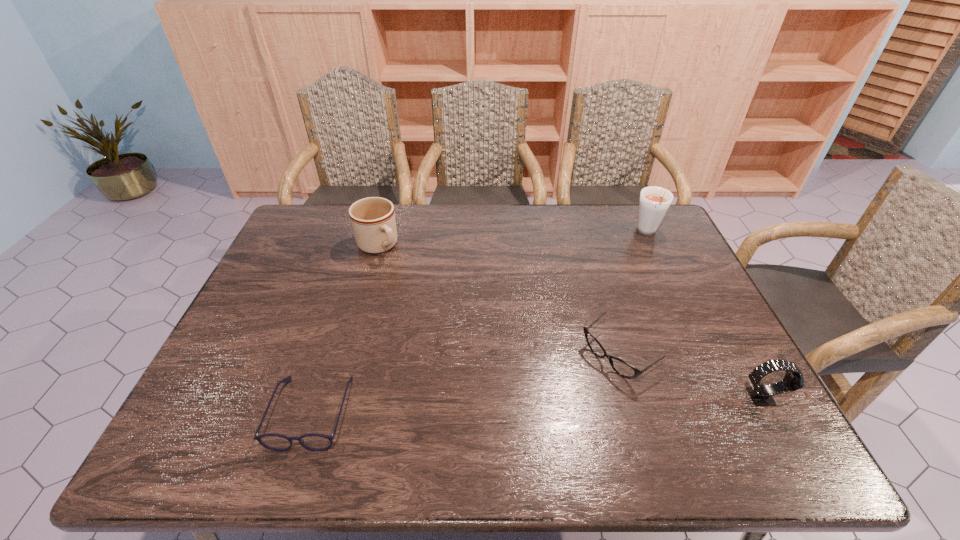
Identify the location of vacant space on the desktop that is between the left spectacles and the watch and is positioned on the side of the mug with the handle. This screenshot has width=960, height=540. (520, 405).

Locate an element on the screen. free space on the desktop that is between the left spectacles and the watch and is positioned on the drink side of the tallest object is located at coordinates (582, 403).

Identify the location of vacant space on the desktop that is between the left spectacles and the watch and is positioned on the front-facing side of the right spectacles. (554, 403).